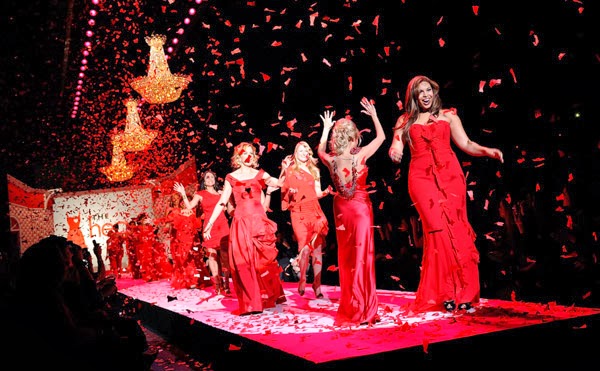
Identify the location of chandelier. pos(160,90).